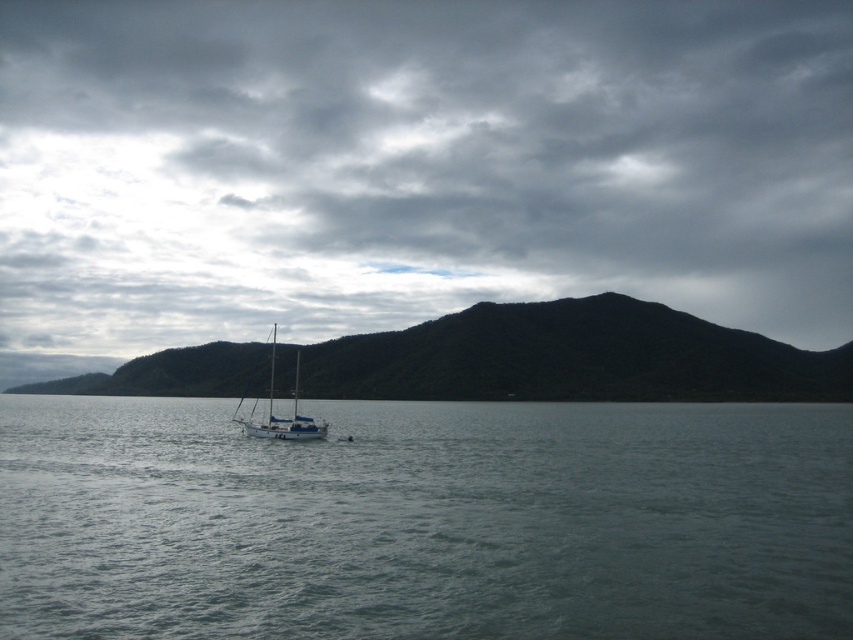
Question: Considering the relative positions of clear water at center and green matte mountain at center in the image provided, where is clear water at center located with respect to green matte mountain at center?

Choices:
 (A) left
 (B) right

Answer: (B)

Question: Among these points, which one is nearest to the camera?

Choices:
 (A) (795, 515)
 (B) (463, 282)

Answer: (A)

Question: Does dark gray cloudy sky at upper center have a smaller size compared to clear water at center?

Choices:
 (A) yes
 (B) no

Answer: (B)

Question: Does green matte mountain at center have a smaller size compared to white matte sailboat at center?

Choices:
 (A) no
 (B) yes

Answer: (A)

Question: Which of the following is the farthest from the observer?

Choices:
 (A) clear water at center
 (B) white matte sailboat at center
 (C) green matte mountain at center
 (D) dark gray cloudy sky at upper center

Answer: (D)

Question: Which object appears closest to the camera in this image?

Choices:
 (A) green matte mountain at center
 (B) dark gray cloudy sky at upper center
 (C) clear water at center

Answer: (C)